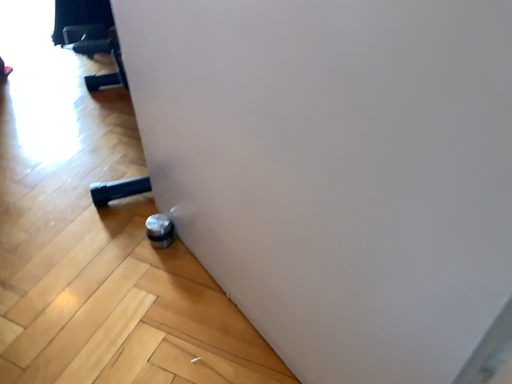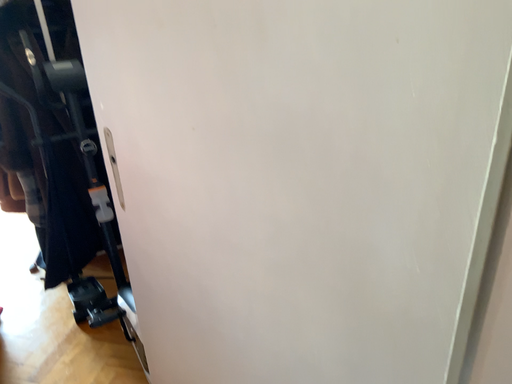
Question: Which way did the camera rotate in the video?

Choices:
 (A) rotated right
 (B) rotated left

Answer: (A)